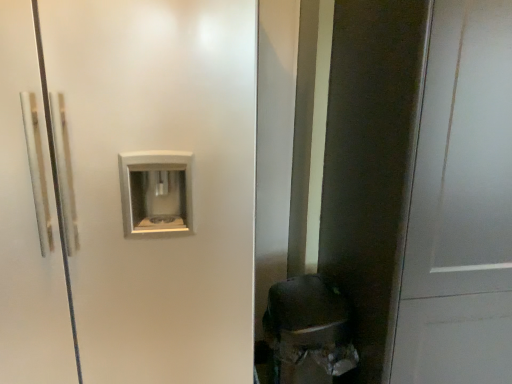
Question: Considering the positions of matte black door at right and white matte screen door at center in the image, is matte black door at right wider or thinner than white matte screen door at center?

Choices:
 (A) wide
 (B) thin

Answer: (B)

Question: From a real-world perspective, is matte black door at right positioned above or below white matte screen door at center?

Choices:
 (A) above
 (B) below

Answer: (B)

Question: Is matte black door at right spatially inside white matte screen door at center, or outside of it?

Choices:
 (A) inside
 (B) outside

Answer: (B)

Question: Considering the positions of white matte screen door at center and matte black door at right in the image, is white matte screen door at center wider or thinner than matte black door at right?

Choices:
 (A) wide
 (B) thin

Answer: (A)

Question: From the image's perspective, is white matte screen door at center located above or below matte black door at right?

Choices:
 (A) above
 (B) below

Answer: (A)

Question: Considering their positions, is white matte screen door at center located in front of or behind matte black door at right?

Choices:
 (A) behind
 (B) front

Answer: (A)

Question: In terms of height, does white matte screen door at center look taller or shorter compared to matte black door at right?

Choices:
 (A) short
 (B) tall

Answer: (B)